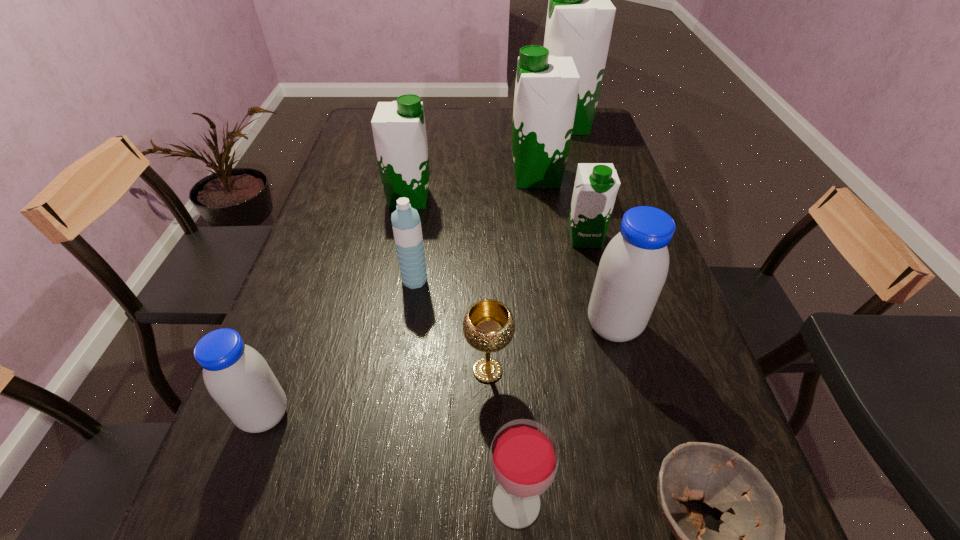
Where is `free space located 0.100m on the front-facing side of the second tallest soya milk`? The height and width of the screenshot is (540, 960). free space located 0.100m on the front-facing side of the second tallest soya milk is located at coordinates (478, 177).

The image size is (960, 540). I want to click on free point located on the front-facing side of the second tallest soya milk, so [385, 177].

Locate an element on the screen. The height and width of the screenshot is (540, 960). vacant position located on the front-facing side of the leftmost green soya milk is located at coordinates (514, 199).

This screenshot has width=960, height=540. What are the coordinates of `vacant position located on the left of the right blue soya milk` in the screenshot? It's located at (467, 326).

Locate an element on the screen. This screenshot has height=540, width=960. vacant area situated on the front of the sixth nearest object is located at coordinates (394, 427).

Where is `free space located 0.270m on the front-facing side of the nearest green soya milk`? Image resolution: width=960 pixels, height=540 pixels. free space located 0.270m on the front-facing side of the nearest green soya milk is located at coordinates (609, 335).

I want to click on vacant area situated on the right of the nearer blue soya milk, so click(365, 415).

The width and height of the screenshot is (960, 540). I want to click on free location located 0.170m on the right of the wineglass, so click(649, 502).

Find the location of a particular element. This screenshot has width=960, height=540. vacant area situated on the back of the fourth nearest object is located at coordinates (487, 294).

Where is `object present at the far edge`? This screenshot has height=540, width=960. object present at the far edge is located at coordinates (580, 16).